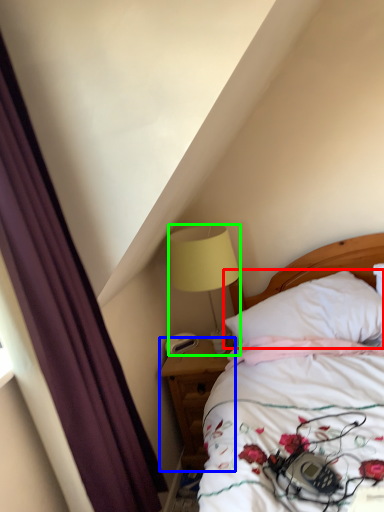
Question: Considering the real-world distances, which object is farthest from pillow (highlighted by a red box)? nightstand (highlighted by a blue box) or lamp (highlighted by a green box)?

Choices:
 (A) nightstand
 (B) lamp

Answer: (A)